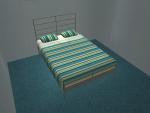
This screenshot has width=150, height=113. I want to click on gap between pillows, so [x=60, y=37].